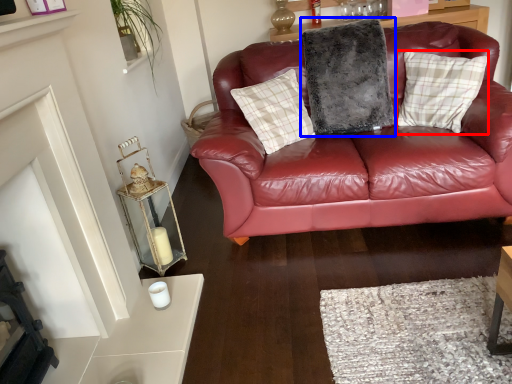
Question: Which object appears farthest to the camera in this image, pillow (highlighted by a red box) or pillow (highlighted by a blue box)?

Choices:
 (A) pillow
 (B) pillow

Answer: (B)